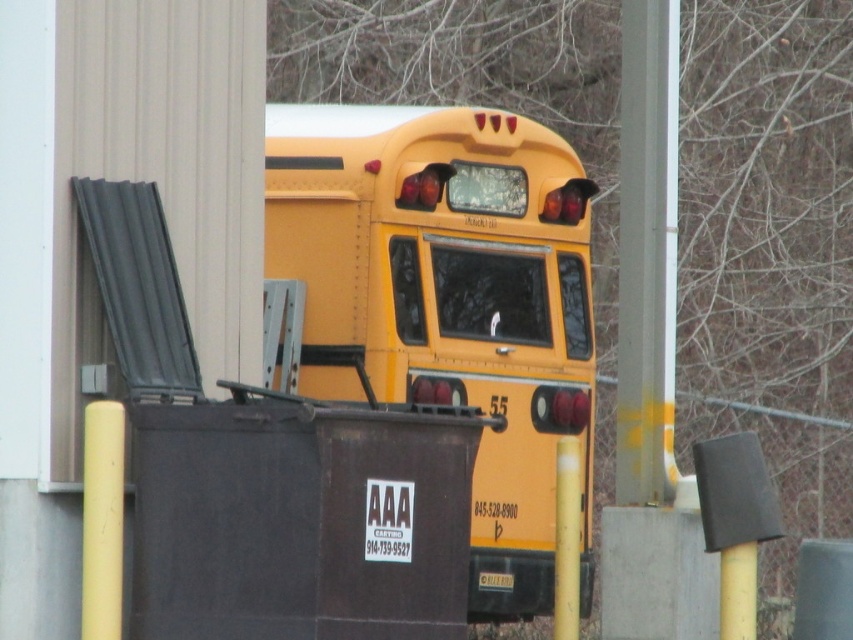
You are a delivery person with a cart that is 1.5 meters wide. You need to navigate between the yellow matte school bus at center and the yellow matte pole at center to reach the loading dock. Can your cart fit through the gap between them?

The distance between the yellow matte school bus at center and the yellow matte pole at center is 1.52 meters. Since your cart is 1.5 meters wide, it can fit through the gap as it is slightly wider than the cart.

You are a delivery driver trying to park your truck in the parking lot. You see the yellow matte school bus at center and the yellow matte pole at center. Which object is closer to you?

The yellow matte pole at center is closer to you because the yellow matte school bus at center is positioned over it, meaning the pole is in front of the bus.

Based on the photo, you are a pedestrian standing at the edge of the road and see the yellow matte school bus at center and the yellow matte pole at center. Which object is closer to your right side?

The yellow matte pole at center is closer to your right side because the yellow matte school bus at center is to the left of it.